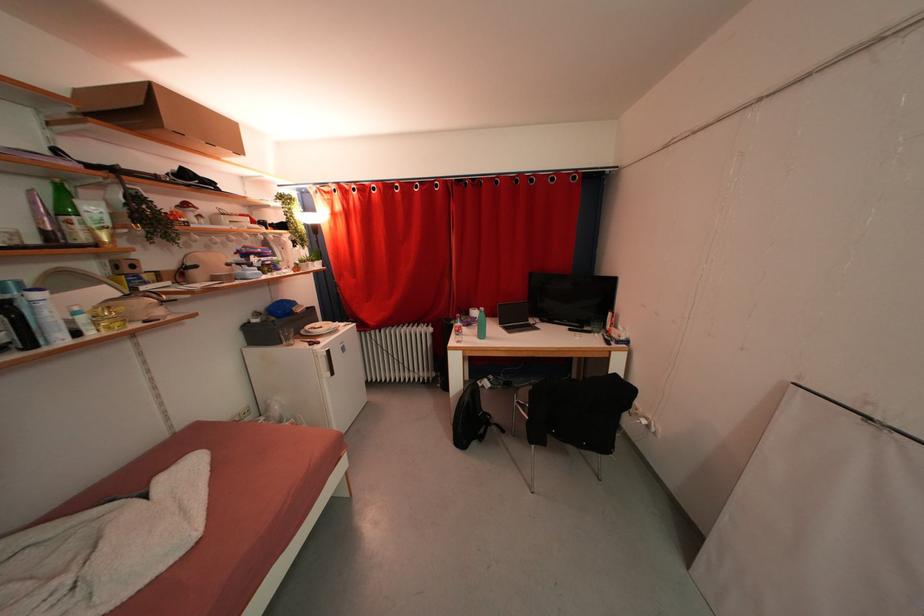
Locate an element on the screen. red curtain is located at coordinates (445, 243).